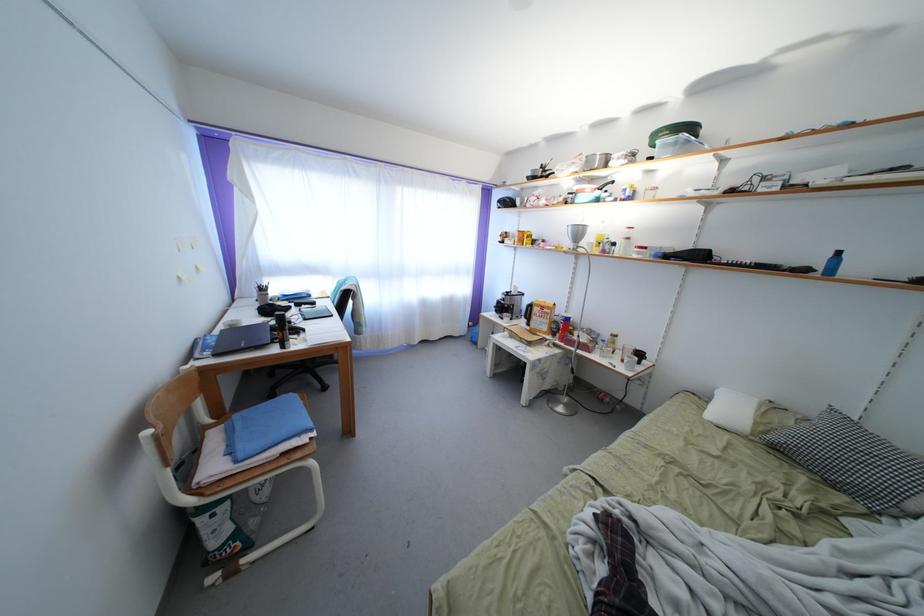
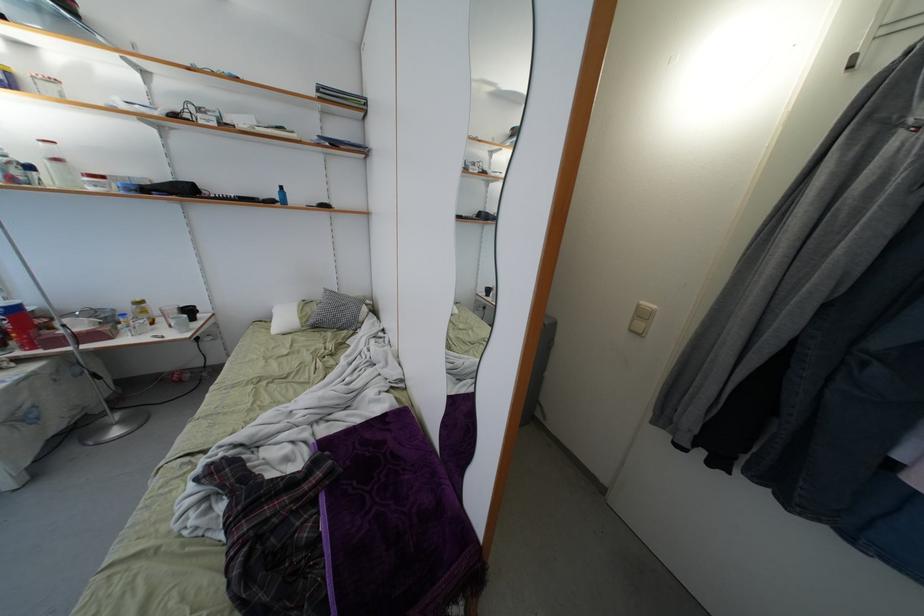
In the second image, find the point that corresponds to the point at 646,361 in the first image.

(195, 315)